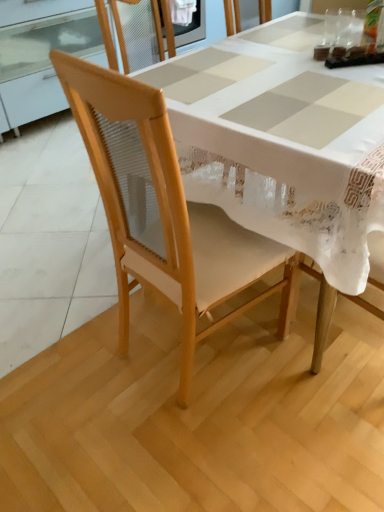
You are a GUI agent. You are given a task and a screenshot of the screen. Output one action in this format:
    pyautogui.click(x=<x>, y=<y>)
    Task: Click on the free spot in front of natural wood chair at center
    
    Given the screenshot: What is the action you would take?
    pyautogui.click(x=206, y=445)